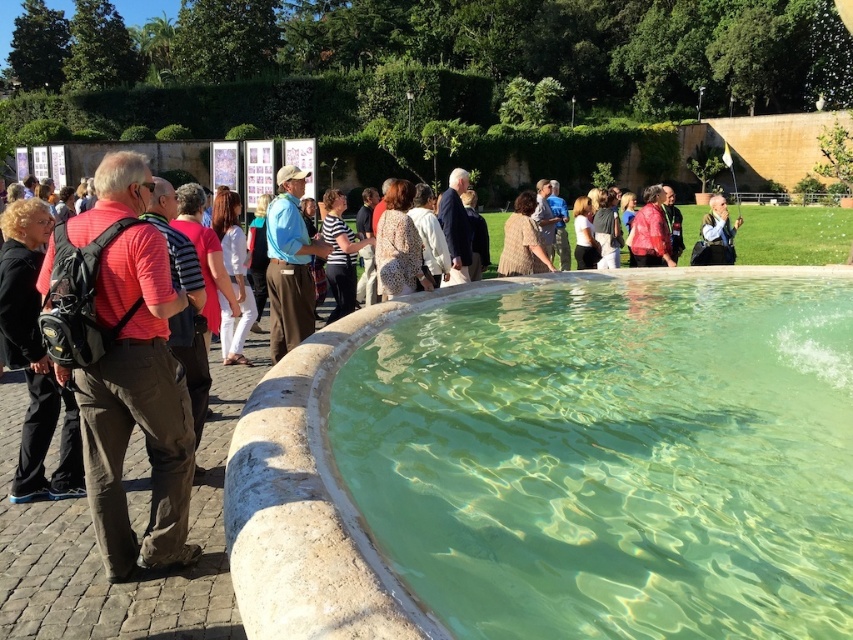
You are a tour guide who needs to distribute maps to visitors. You have two bags to choose from, the matte black backpack at left and the white fabric bag at upper right. Which bag do you think can hold more maps?

The matte black backpack at left is bigger than the white fabric bag at upper right, so it can hold more maps.

You are standing at the edge of the clear stone pool at center and want to place your matte black backpack at left on the pool edge. Considering the height of the pool edge, will the backpack fit without hanging over?

The clear stone pool at center is not as tall as the matte black backpack at left, so the backpack will hang over the edge since the pool edge is shorter than the backpack.

You are a photographer standing in the scene and want to capture both the matte black backpack at left and the white fabric bag at upper right in a single shot. Which object should you focus on first to ensure both are in frame?

You should focus on the matte black backpack at left first since it is positioned lower than the white fabric bag at upper right, allowing you to adjust your camera angle to include both in the frame.